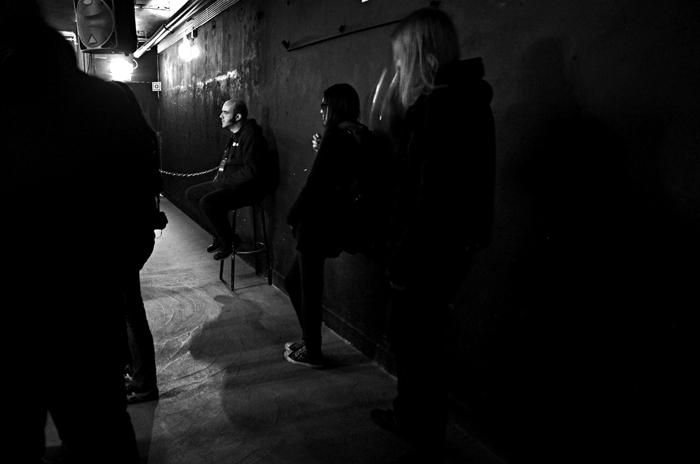
What are the coordinates of `wall` in the screenshot? It's located at (511, 104).